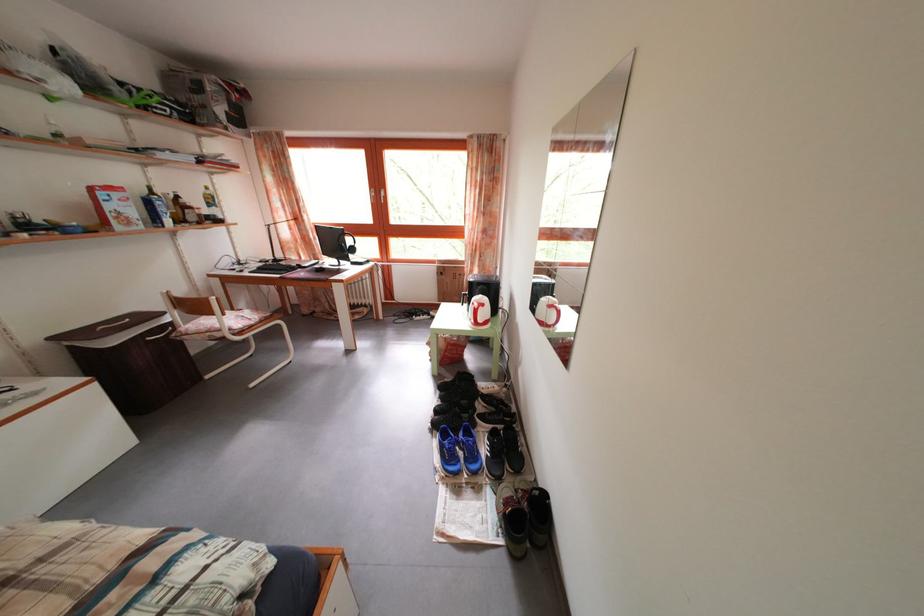
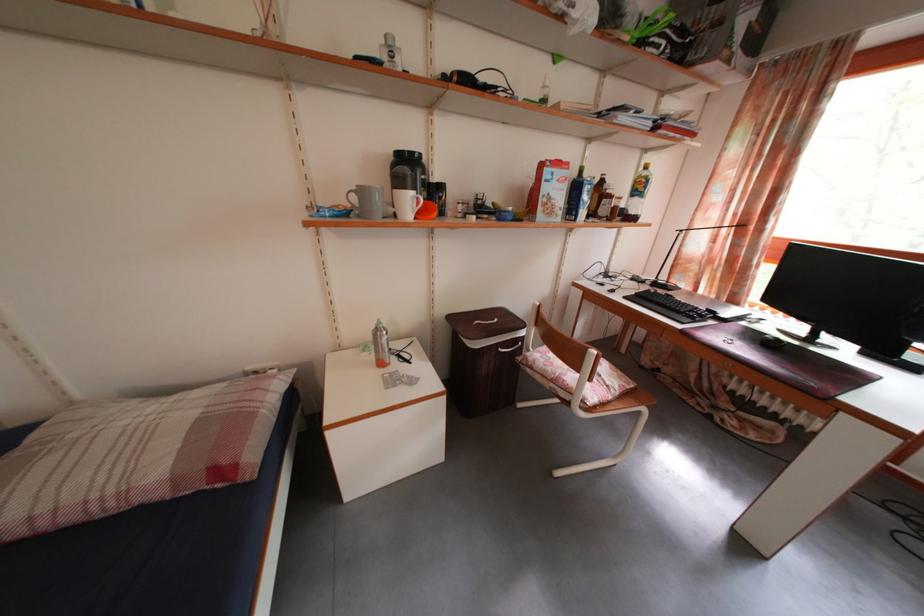
Where in the second image is the point corresponding to pixel 286 264 from the first image?

(671, 285)